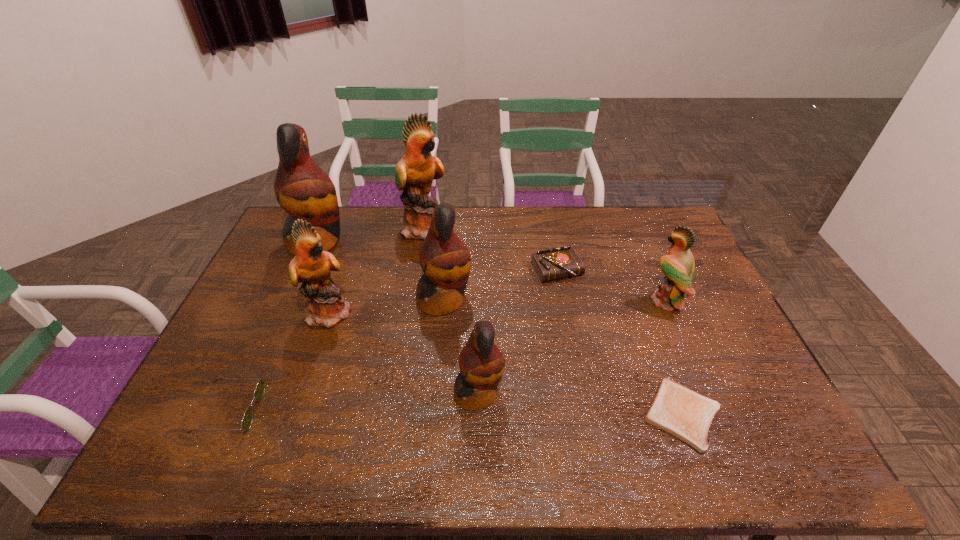
You are a GUI agent. You are given a task and a screenshot of the screen. Output one action in this format:
    pyautogui.click(x=<x>, y=<y>)
    Task: Click on the diary
    This screenshot has height=540, width=960.
    Given the screenshot: What is the action you would take?
    pyautogui.click(x=561, y=262)

Find the location of `sunglasses`. sunglasses is located at coordinates (247, 419).

Identify the location of toast. The image size is (960, 540). [676, 409].

Locate an element on the screen. vacant region located 0.130m on the front-facing side of the farthest green parrot is located at coordinates (484, 227).

You are a GUI agent. You are given a task and a screenshot of the screen. Output one action in this format:
    pyautogui.click(x=<x>, y=<y>)
    Task: Click on the free space located on the face of the biggest red parrot
    The image size is (960, 540).
    Given the screenshot: What is the action you would take?
    pyautogui.click(x=422, y=242)

The width and height of the screenshot is (960, 540). Find the location of `blank space located on the face of the second farthest red parrot`. blank space located on the face of the second farthest red parrot is located at coordinates (591, 300).

In order to click on vacant region located 0.240m on the front-facing side of the second biggest green parrot in this screenshot , I will do `click(435, 312)`.

In order to click on vacant area situated on the front-facing side of the smallest green parrot in this screenshot , I will do `click(528, 301)`.

Where is `vacant space located 0.280m on the front-facing side of the smallest green parrot`? The width and height of the screenshot is (960, 540). vacant space located 0.280m on the front-facing side of the smallest green parrot is located at coordinates (557, 301).

Identify the location of free region located on the front-facing side of the smallest green parrot. This screenshot has width=960, height=540. (538, 301).